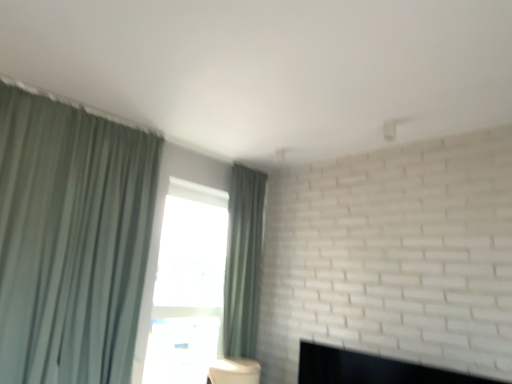
Question: Is black matte fireplace at lower right smaller than green fabric curtain at center, positioned as the second curtain in front-to-back order?

Choices:
 (A) no
 (B) yes

Answer: (B)

Question: Does black matte fireplace at lower right appear on the right side of green fabric curtain at center, placed as the second curtain when sorted from left to right?

Choices:
 (A) yes
 (B) no

Answer: (A)

Question: Considering the relative sizes of black matte fireplace at lower right and green fabric curtain at center, positioned as the second curtain in front-to-back order, in the image provided, is black matte fireplace at lower right shorter than green fabric curtain at center, positioned as the second curtain in front-to-back order,?

Choices:
 (A) no
 (B) yes

Answer: (B)

Question: Can green fabric curtain at center, positioned as the second curtain in front-to-back order, be found inside black matte fireplace at lower right?

Choices:
 (A) yes
 (B) no

Answer: (B)

Question: Can you confirm if black matte fireplace at lower right is bigger than green fabric curtain at center, which is the 1th curtain in right-to-left order?

Choices:
 (A) no
 (B) yes

Answer: (A)

Question: Is black matte fireplace at lower right positioned before green fabric curtain at center, placed as the second curtain when sorted from left to right?

Choices:
 (A) no
 (B) yes

Answer: (B)

Question: Considering the relative positions of black matte fireplace at lower right and green fabric curtain at left, arranged as the second curtain when viewed from the right, in the image provided, is black matte fireplace at lower right to the right of green fabric curtain at left, arranged as the second curtain when viewed from the right, from the viewer's perspective?

Choices:
 (A) yes
 (B) no

Answer: (A)

Question: From the image's perspective, is black matte fireplace at lower right below green fabric curtain at left, arranged as the second curtain when viewed from the right?

Choices:
 (A) yes
 (B) no

Answer: (A)

Question: Can you confirm if black matte fireplace at lower right is smaller than green fabric curtain at left, positioned as the 2th curtain in back-to-front order?

Choices:
 (A) no
 (B) yes

Answer: (B)

Question: Is black matte fireplace at lower right at the left side of green fabric curtain at left, which is counted as the 1th curtain, starting from the left?

Choices:
 (A) no
 (B) yes

Answer: (A)

Question: Does black matte fireplace at lower right come in front of green fabric curtain at left, arranged as the second curtain when viewed from the right?

Choices:
 (A) yes
 (B) no

Answer: (A)

Question: Would you say green fabric curtain at left, arranged as the second curtain when viewed from the right, is part of black matte fireplace at lower right's contents?

Choices:
 (A) no
 (B) yes

Answer: (A)

Question: Considering the relative positions of green fabric curtain at left, which ranks as the first curtain in front-to-back order, and green fabric curtain at center, which is the 1th curtain in right-to-left order, in the image provided, is green fabric curtain at left, which ranks as the first curtain in front-to-back order, in front of green fabric curtain at center, which is the 1th curtain in right-to-left order,?

Choices:
 (A) no
 (B) yes

Answer: (B)